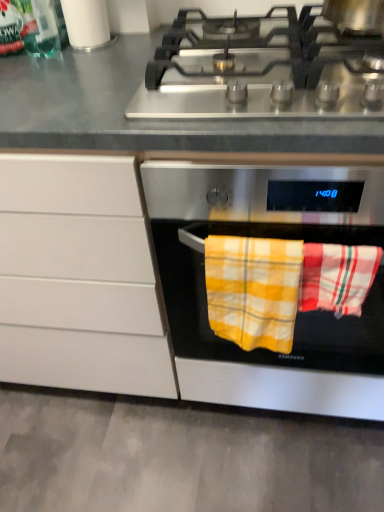
Question: From a real-world perspective, is stainless steel gas stove at upper center beneath yellow plaid towel at center, which is the 2th beach towel from right to left?

Choices:
 (A) yes
 (B) no

Answer: (B)

Question: Can you confirm if stainless steel gas stove at upper center is positioned to the right of yellow plaid towel at center, which is the 1th beach towel from left to right?

Choices:
 (A) yes
 (B) no

Answer: (A)

Question: Can you confirm if stainless steel gas stove at upper center is smaller than yellow plaid towel at center, which is the 1th beach towel from left to right?

Choices:
 (A) no
 (B) yes

Answer: (A)

Question: Is stainless steel gas stove at upper center not within yellow plaid towel at center, which is the 1th beach towel from left to right?

Choices:
 (A) no
 (B) yes

Answer: (B)

Question: Is stainless steel gas stove at upper center oriented towards yellow plaid towel at center, which is the 1th beach towel from left to right?

Choices:
 (A) no
 (B) yes

Answer: (A)

Question: Considering the relative positions of red plaid beach towel at center, placed as the second beach towel when sorted from left to right, and white paper towel at upper left in the image provided, is red plaid beach towel at center, placed as the second beach towel when sorted from left to right, to the left or to the right of white paper towel at upper left?

Choices:
 (A) left
 (B) right

Answer: (B)

Question: Is red plaid beach towel at center, the first beach towel when ordered from right to left, wider or thinner than white paper towel at upper left?

Choices:
 (A) wide
 (B) thin

Answer: (B)

Question: From a real-world perspective, relative to white paper towel at upper left, is red plaid beach towel at center, placed as the second beach towel when sorted from left to right, vertically above or below?

Choices:
 (A) below
 (B) above

Answer: (A)

Question: Is red plaid beach towel at center, the first beach towel when ordered from right to left, taller or shorter than white paper towel at upper left?

Choices:
 (A) short
 (B) tall

Answer: (A)

Question: Considering the positions of yellow plaid towel at center, which is the 1th beach towel from left to right, and white paper towel at upper left in the image, is yellow plaid towel at center, which is the 1th beach towel from left to right, wider or thinner than white paper towel at upper left?

Choices:
 (A) thin
 (B) wide

Answer: (A)

Question: Is yellow plaid towel at center, which is the 2th beach towel from right to left, taller or shorter than white paper towel at upper left?

Choices:
 (A) short
 (B) tall

Answer: (A)

Question: Is yellow plaid towel at center, which is the 2th beach towel from right to left, inside or outside of white paper towel at upper left?

Choices:
 (A) inside
 (B) outside

Answer: (B)

Question: Would you say yellow plaid towel at center, which is the 2th beach towel from right to left, is to the left or to the right of white paper towel at upper left in the picture?

Choices:
 (A) left
 (B) right

Answer: (B)

Question: Is white matte cabinet at center wider or thinner than metallic silver pot at upper right?

Choices:
 (A) wide
 (B) thin

Answer: (A)

Question: Is white matte cabinet at center inside or outside of metallic silver pot at upper right?

Choices:
 (A) inside
 (B) outside

Answer: (B)